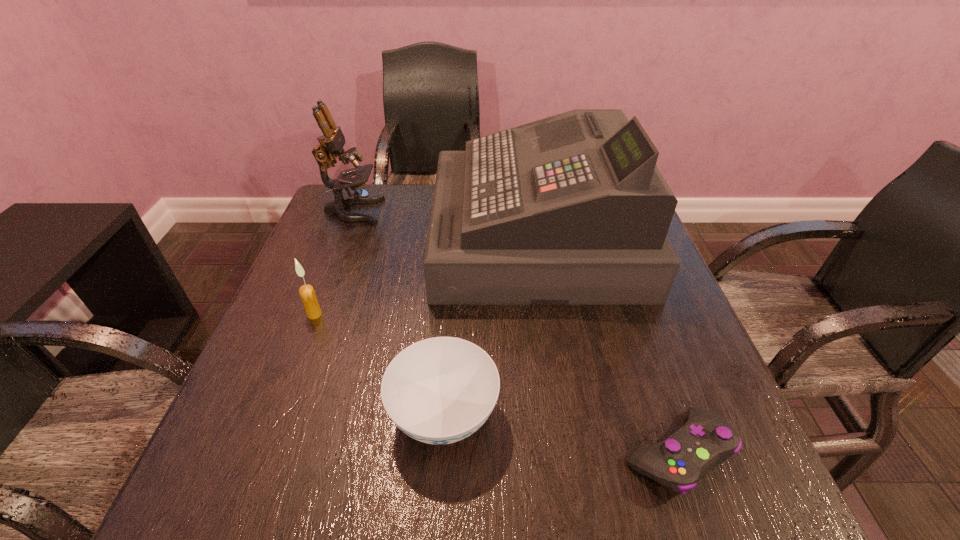
In order to click on cash register in this screenshot , I will do `click(571, 209)`.

Where is `microscope`? The width and height of the screenshot is (960, 540). microscope is located at coordinates (332, 141).

Find the location of `the third tallest object`. the third tallest object is located at coordinates (307, 293).

Image resolution: width=960 pixels, height=540 pixels. Find the location of `the third farthest object`. the third farthest object is located at coordinates (307, 293).

Find the location of a particular element. the second shortest object is located at coordinates (440, 390).

Locate an element on the screen. The width and height of the screenshot is (960, 540). the shortest object is located at coordinates (705, 441).

You are a GUI agent. You are given a task and a screenshot of the screen. Output one action in this format:
    pyautogui.click(x=<x>, y=<y>)
    Task: Click on the free space located on the front-facing side of the cash register
    Image resolution: width=960 pixels, height=540 pixels.
    Given the screenshot: What is the action you would take?
    pyautogui.click(x=334, y=237)

You are a GUI agent. You are given a task and a screenshot of the screen. Output one action in this format:
    pyautogui.click(x=<x>, y=<y>)
    Task: Click on the blank area located 0.170m on the front-facing side of the cash register
    
    Given the screenshot: What is the action you would take?
    pyautogui.click(x=370, y=237)

Locate an element on the screen. This screenshot has width=960, height=540. free space located on the front-facing side of the cash register is located at coordinates (342, 237).

You are a GUI agent. You are given a task and a screenshot of the screen. Output one action in this format:
    pyautogui.click(x=<x>, y=<y>)
    Task: Click on the free spot located 0.100m at the eyepieces of the microscope
    Image resolution: width=960 pixels, height=540 pixels.
    Given the screenshot: What is the action you would take?
    pyautogui.click(x=418, y=211)